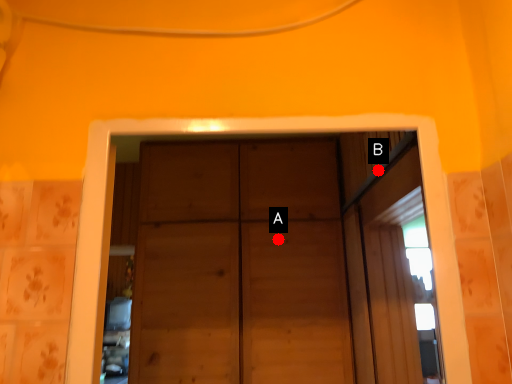
Question: Two points are circled on the image, labeled by A and B beside each circle. Among these points, which one is nearest to the camera?

Choices:
 (A) A is closer
 (B) B is closer

Answer: (B)